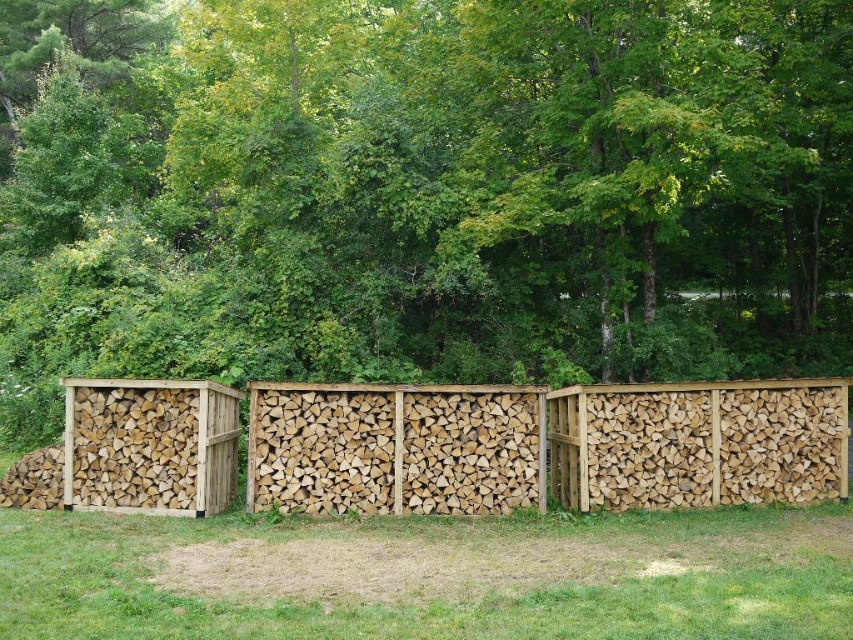
Between natural green leaves at center and green grass at lower center, which one has more height?

natural green leaves at center is taller.

Can you confirm if natural green leaves at center is positioned above green grass at lower center?

Indeed, natural green leaves at center is positioned over green grass at lower center.

Describe the element at coordinates (422, 193) in the screenshot. The image size is (853, 640). I see `natural green leaves at center` at that location.

Find the location of a particular element. natural green leaves at center is located at coordinates (422, 193).

Is natural green leaves at center positioned in front of natural wood fence at center?

No, natural green leaves at center is behind natural wood fence at center.

Does point (799, 49) come farther from viewer compared to point (758, 502)?

Yes, it is behind point (758, 502).

Is point (415, 282) closer to viewer compared to point (515, 433)?

No, (415, 282) is behind (515, 433).

Identify the location of natural green leaves at center. The image size is (853, 640). (422, 193).

Is green grass at lower center positioned before natural wood fence at center?

Yes, green grass at lower center is closer to the viewer.

Which is in front, point (349, 612) or point (543, 396)?

Positioned in front is point (349, 612).

The image size is (853, 640). What do you see at coordinates (434, 577) in the screenshot?
I see `green grass at lower center` at bounding box center [434, 577].

Image resolution: width=853 pixels, height=640 pixels. What are the coordinates of `green grass at lower center` in the screenshot? It's located at (434, 577).